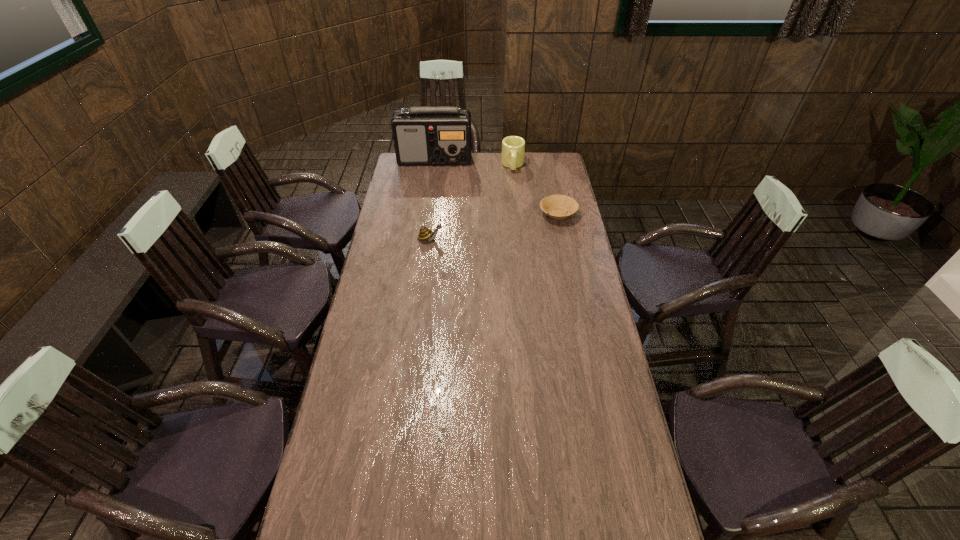
The height and width of the screenshot is (540, 960). Identify the location of vacant space at the right edge of the desktop. (563, 272).

Locate an element on the screen. blank space at the far left corner of the desktop is located at coordinates (402, 175).

Locate an element on the screen. vacant space at the far right corner of the desktop is located at coordinates (553, 173).

The height and width of the screenshot is (540, 960). In order to click on free space at the near right corner in this screenshot , I will do `click(607, 515)`.

The width and height of the screenshot is (960, 540). I want to click on vacant region between the tallest object and the snail, so click(433, 199).

Find the location of a particular element. This screenshot has width=960, height=540. vacant area between the mug and the tallest object is located at coordinates (473, 163).

The height and width of the screenshot is (540, 960). Find the location of `empty space between the third object from left to right and the radio receiver`. empty space between the third object from left to right and the radio receiver is located at coordinates (473, 163).

This screenshot has height=540, width=960. Identify the location of vacant area that lies between the snail and the second nearest object. (494, 226).

The image size is (960, 540). I want to click on free space between the nearest object and the radio receiver, so click(x=433, y=199).

Identify the location of vacant space that's between the tallest object and the bowl. The image size is (960, 540). (496, 187).